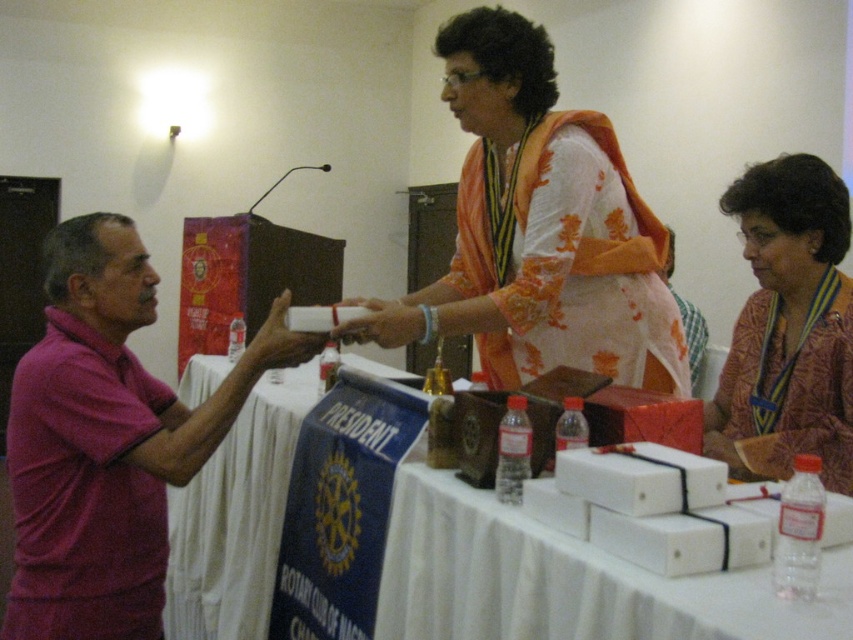
Question: Which of the following is the closest to the observer?

Choices:
 (A) (761, 241)
 (B) (274, 346)
 (C) (392, 340)
 (D) (207, 456)

Answer: (D)

Question: Can you confirm if patterned fabric scarf at upper right is positioned to the left of matte white box at center?

Choices:
 (A) no
 (B) yes

Answer: (A)

Question: Which of the following is the closest to the observer?

Choices:
 (A) (131, 243)
 (B) (268, 330)
 (C) (248, 497)
 (D) (415, 339)

Answer: (B)

Question: Does white cloth at center lie in front of matte white box at center?

Choices:
 (A) no
 (B) yes

Answer: (A)

Question: Does pink shirt at left have a larger size compared to white cloth at center?

Choices:
 (A) no
 (B) yes

Answer: (A)

Question: Among these objects, which one is farthest from the camera?

Choices:
 (A) white embroidered dress at center
 (B) matte white box at center
 (C) matte white remote at center

Answer: (C)